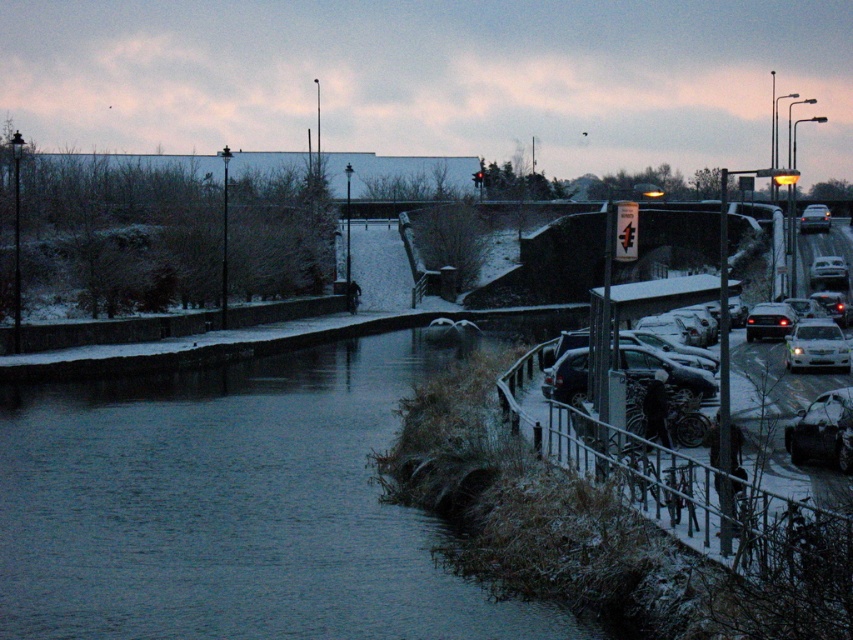
You are standing at the edge of the canal in the winter scene. There is a point marked at coordinates (230, 508). What is located at that point?

The point at coordinates (230, 508) marks the location of dark blue water at center.

You are a delivery person needing to load a tall package onto a vehicle. You see the shiny silver car at lower right and the shiny black sedan at right. Which vehicle should you choose to ensure the package will fit?

The shiny black sedan at right is taller than the shiny silver car at lower right, so you should choose the shiny black sedan at right to ensure the tall package will fit.